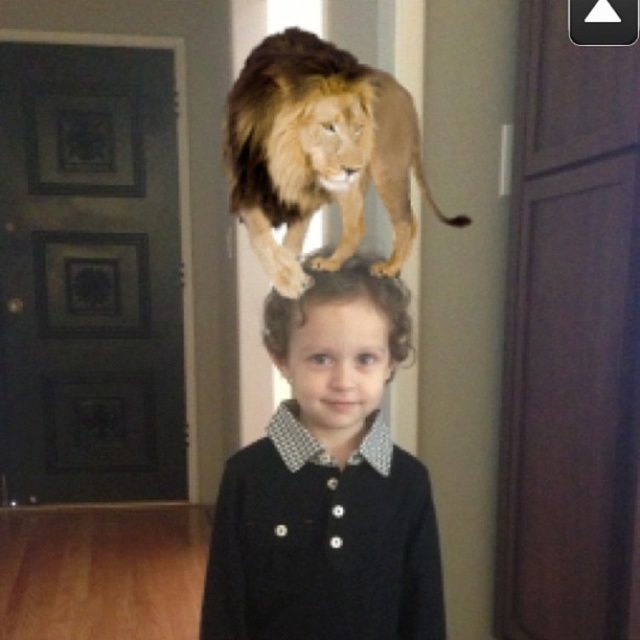
From the picture: Between golden fur lion at center and matte black hair at center, which one is positioned lower?

Positioned lower is matte black hair at center.

Does point (323, 173) come behind point (257, 276)?

No, it is in front of (257, 276).

The width and height of the screenshot is (640, 640). I want to click on golden fur lion at center, so click(320, 152).

Is black matte dress at center behind golden fur lion at center?

No, black matte dress at center is in front of golden fur lion at center.

Is black matte dress at center taller than golden fur lion at center?

Yes, black matte dress at center is taller than golden fur lion at center.

Identify the location of black matte dress at center. This screenshot has height=640, width=640. click(x=326, y=484).

From the picture: Can you confirm if black matte dress at center is positioned to the left of matte black hair at center?

Incorrect, black matte dress at center is not on the left side of matte black hair at center.

Is point (355, 548) farther from camera compared to point (412, 387)?

That is False.

Locate an element on the screen. black matte dress at center is located at coordinates (326, 484).